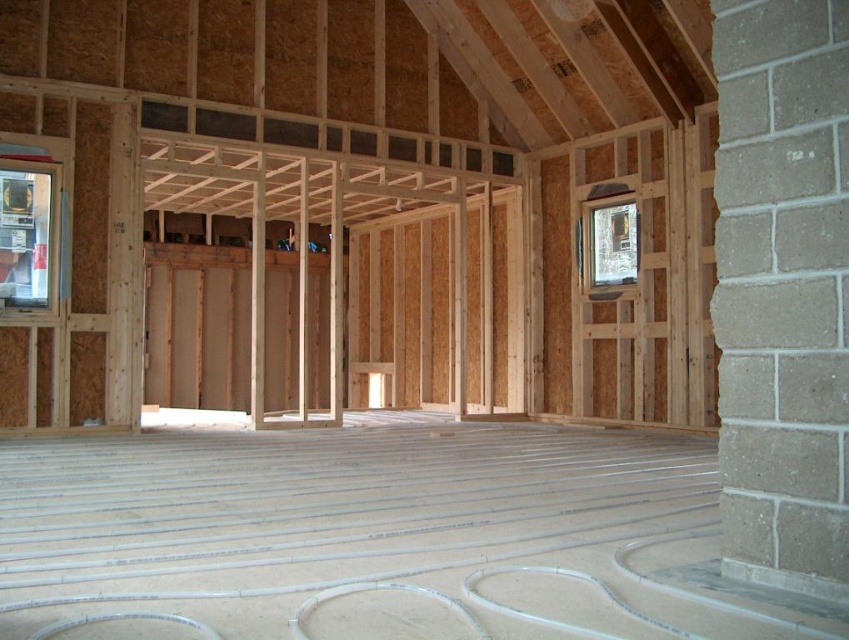
Question: Among these objects, which one is nearest to the camera?

Choices:
 (A) clear glass window at left
 (B) clear glass window at upper right

Answer: (A)

Question: Is clear glass window at left further to the viewer compared to clear glass window at upper right?

Choices:
 (A) no
 (B) yes

Answer: (A)

Question: Where is clear glass window at left located in relation to clear glass window at upper right in the image?

Choices:
 (A) right
 (B) left

Answer: (B)

Question: Considering the relative positions of clear glass window at left and clear glass window at upper right in the image provided, where is clear glass window at left located with respect to clear glass window at upper right?

Choices:
 (A) right
 (B) left

Answer: (B)